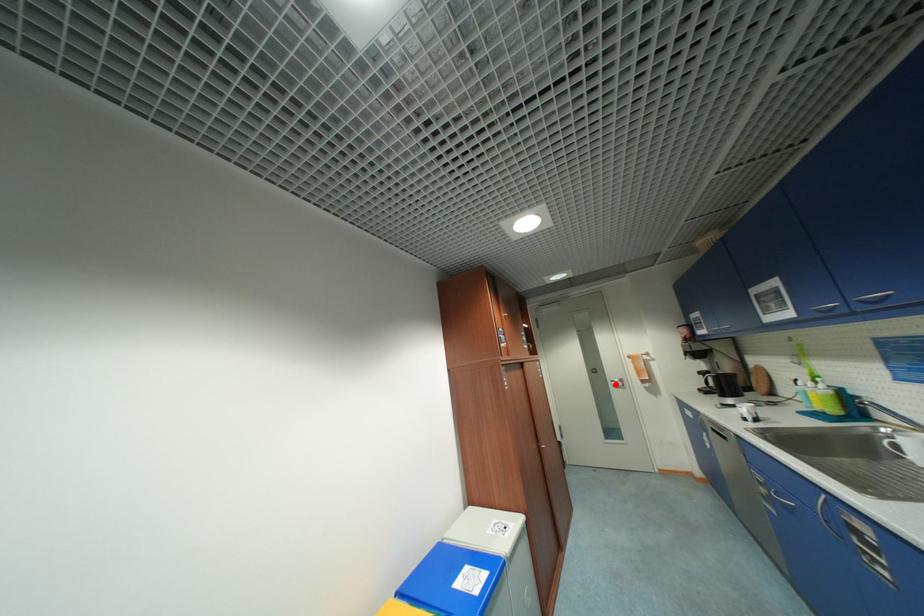
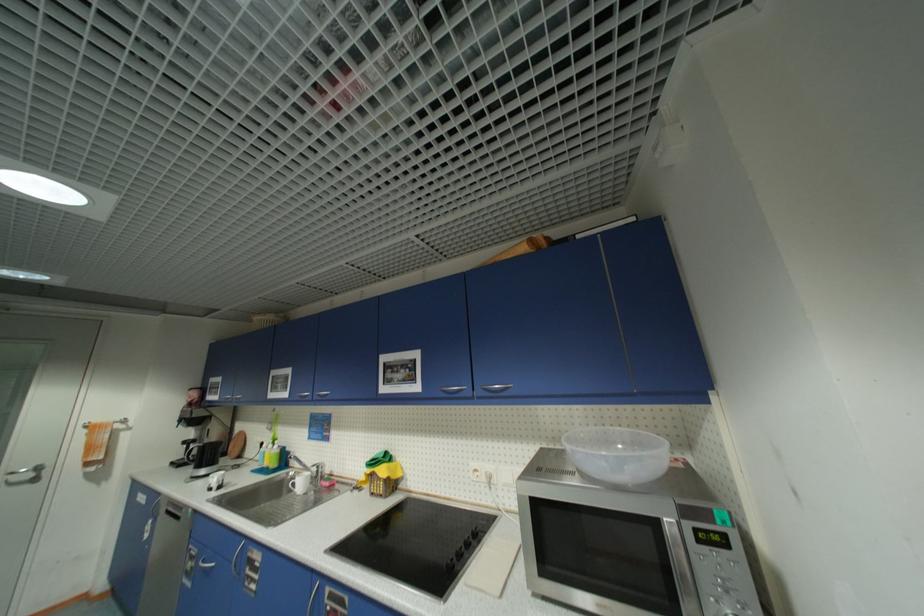
The point at the highlighted location is marked in the first image. Where is the corresponding point in the second image?

(7, 479)